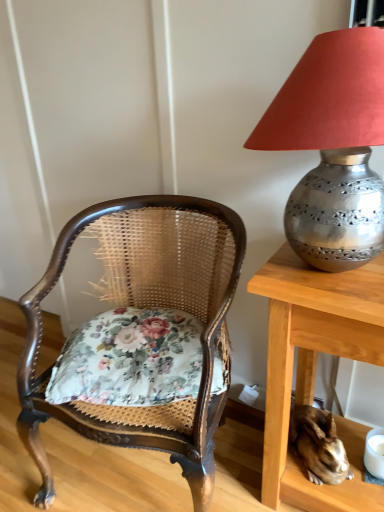
Question: Is point (152, 367) positioned closer to the camera than point (291, 87)?

Choices:
 (A) closer
 (B) farther

Answer: (B)

Question: Looking at their shapes, would you say floral fabric cushion at center is wider or thinner than metallic silver lampshade at upper right?

Choices:
 (A) thin
 (B) wide

Answer: (B)

Question: Estimate the real-world distances between objects in this image. Which object is closer to the floral fabric cushion at center?

Choices:
 (A) metallic silver lampshade at upper right
 (B) shiny metallic rabbit at lower right
 (C) wooden cane chair with floral cushion at left

Answer: (C)

Question: Which object is the closest to the shiny metallic rabbit at lower right?

Choices:
 (A) floral fabric cushion at center
 (B) wooden cane chair with floral cushion at left
 (C) metallic silver lampshade at upper right

Answer: (A)